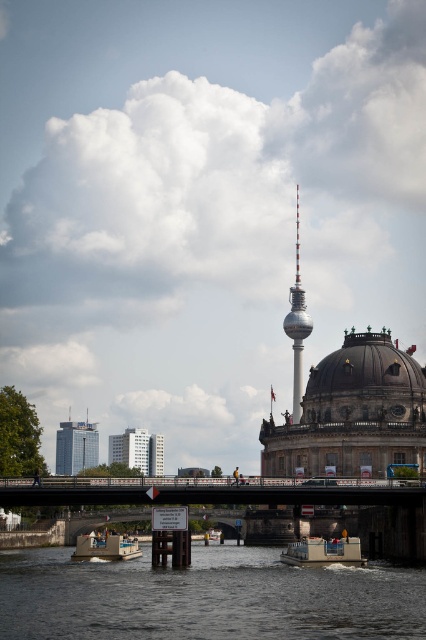
You are a tourist in Berlin and want to take a photo of the silver metallic tower at center and the white plastic boat at lower center. Which object should you focus on first if you want to capture both in one frame without moving the camera?

You should focus on the silver metallic tower at center first because it is taller than the white plastic boat at lower center, allowing it to be captured in the frame more easily while the boat remains in view.

In the scene shown: You are standing near the river and want to take a photo of the white glass building at center and the wooden boat at center. Which object should you focus on first to ensure both are in the frame?

You should focus on the wooden boat at center first because it is closer to you than the white glass building at center, allowing both to be in the frame.